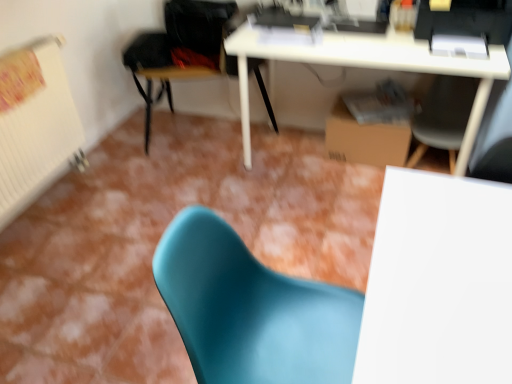
Where is `free space underneath white glossy desk at upper center (from a real-world perspective)`? free space underneath white glossy desk at upper center (from a real-world perspective) is located at coordinates point(311,159).